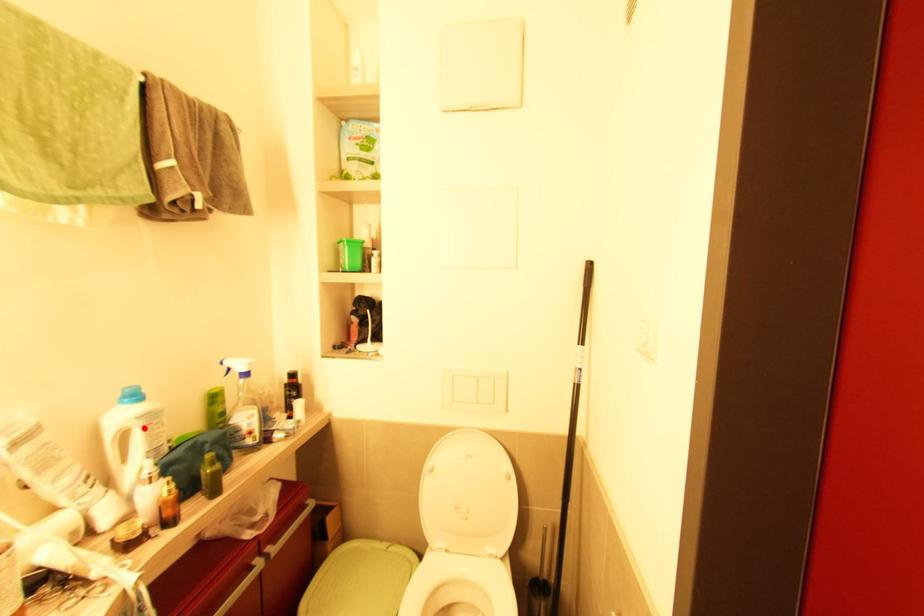
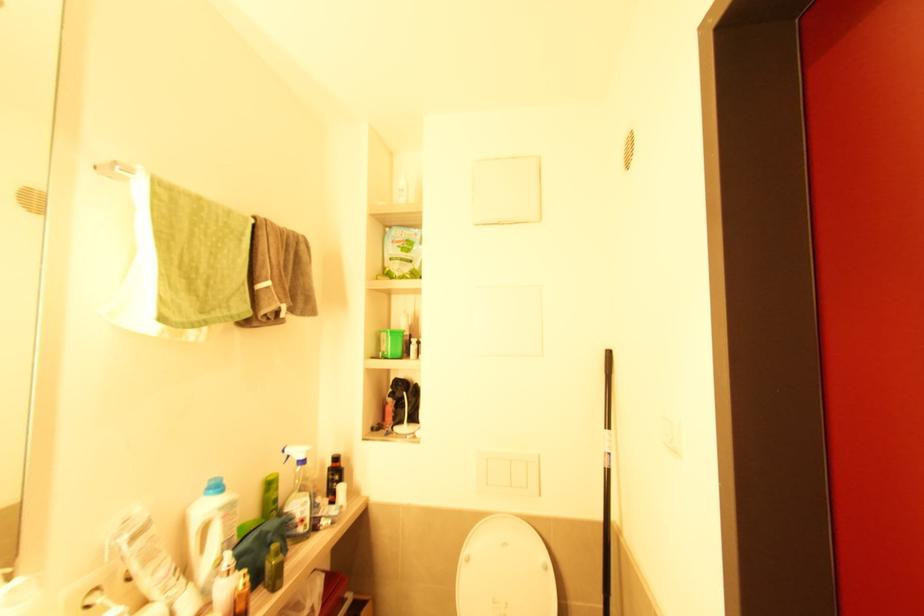
Question: I am providing you with two images of the same scene from different viewpoints. A red point is marked on the first image. At the location where the point appears in image 1, is it still visible in image 2?

Choices:
 (A) Yes
 (B) No

Answer: (A)